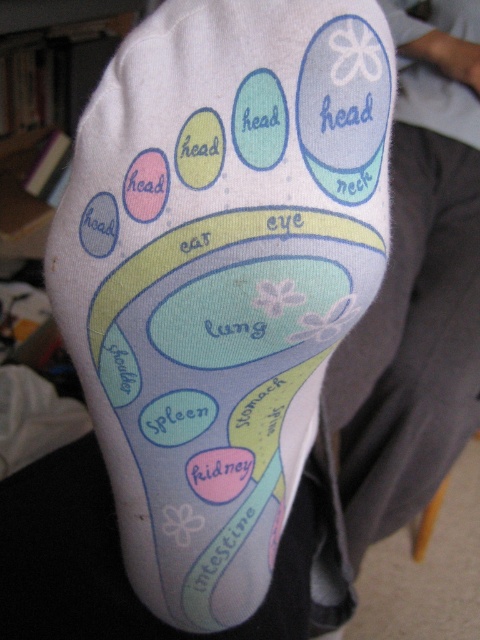
Question: Is white fabric paw print at center to the right of white fabric at upper right from the viewer's perspective?

Choices:
 (A) no
 (B) yes

Answer: (A)

Question: Which point is farther to the camera?

Choices:
 (A) (398, 19)
 (B) (204, 396)

Answer: (A)

Question: Is white fabric paw print at center further to the viewer compared to white fabric at upper right?

Choices:
 (A) no
 (B) yes

Answer: (A)

Question: Is white fabric paw print at center smaller than white fabric at upper right?

Choices:
 (A) yes
 (B) no

Answer: (B)